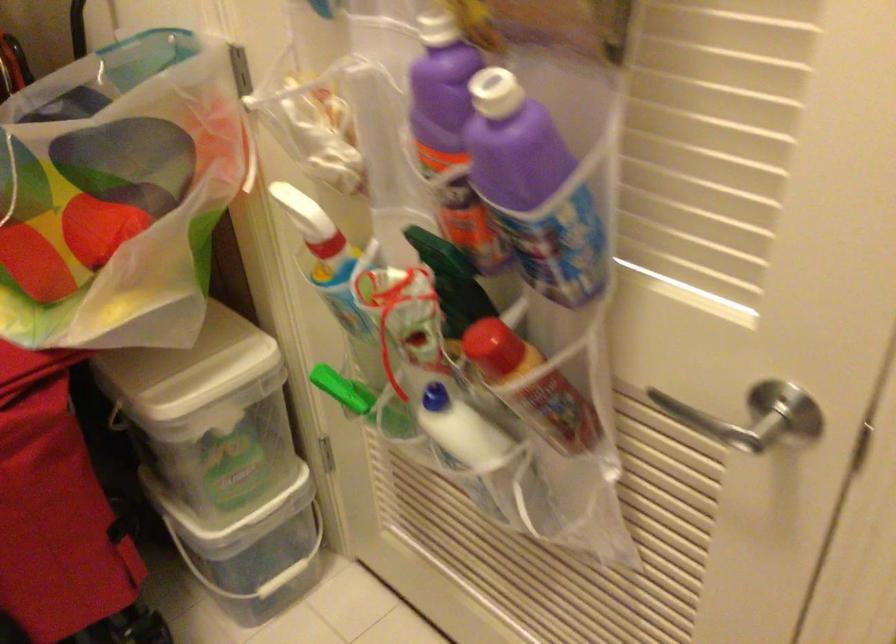
How did the camera likely rotate?

The camera rotated toward left-up.